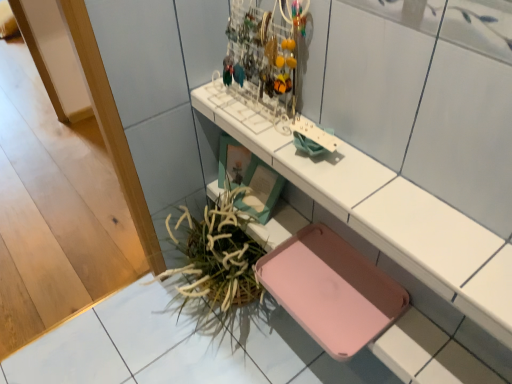
This screenshot has width=512, height=384. What do you see at coordinates (389, 216) in the screenshot?
I see `pink plastic tray at upper center` at bounding box center [389, 216].

Locate an element on the screen. Image resolution: width=512 pixels, height=384 pixels. pink plastic tray at upper center is located at coordinates (389, 216).

The width and height of the screenshot is (512, 384). What do you see at coordinates (217, 255) in the screenshot?
I see `green leafy plant at lower left` at bounding box center [217, 255].

Locate an element on the screen. green leafy plant at lower left is located at coordinates (217, 255).

Locate an element on the screen. The height and width of the screenshot is (384, 512). pink plastic tray at upper center is located at coordinates (389, 216).

From the picture: Which object is positioned more to the right, pink plastic tray at upper center or green leafy plant at lower left?

Positioned to the right is pink plastic tray at upper center.

Which object is further away from the camera taking this photo, pink plastic tray at upper center or green leafy plant at lower left?

Positioned behind is green leafy plant at lower left.

Is point (388, 195) farther from camera compared to point (228, 244)?

No, (388, 195) is closer to viewer.

From the image's perspective, would you say pink plastic tray at upper center is shown under green leafy plant at lower left?

No.

From a real-world perspective, between pink plastic tray at upper center and green leafy plant at lower left, who is vertically lower?

green leafy plant at lower left, from a real-world perspective.

Which object is thinner, pink plastic tray at upper center or green leafy plant at lower left?

pink plastic tray at upper center is thinner.

Looking at this image, is pink plastic tray at upper center shorter than green leafy plant at lower left?

Indeed, pink plastic tray at upper center has a lesser height compared to green leafy plant at lower left.

Looking at this image, who is smaller, pink plastic tray at upper center or green leafy plant at lower left?

With smaller size is pink plastic tray at upper center.

Is green leafy plant at lower left surrounded by pink plastic tray at upper center?

Actually, green leafy plant at lower left is outside pink plastic tray at upper center.

Is pink plastic tray at upper center with green leafy plant at lower left?

They are not placed beside each other.

Consider the image. Is pink plastic tray at upper center positioned with its back to green leafy plant at lower left?

No, green leafy plant at lower left is not at the back of pink plastic tray at upper center.

Can you tell me how much pink plastic tray at upper center and green leafy plant at lower left differ in facing direction?

The angle between the facing direction of pink plastic tray at upper center and the facing direction of green leafy plant at lower left is 0.756 degrees.

Locate an element on the screen. The height and width of the screenshot is (384, 512). shelf located on the right of green leafy plant at lower left is located at coordinates click(x=389, y=216).

Consider the image. Which is more to the right, green leafy plant at lower left or pink plastic tray at upper center?

pink plastic tray at upper center.

Considering the positions of objects green leafy plant at lower left and pink plastic tray at upper center in the image provided, who is in front, green leafy plant at lower left or pink plastic tray at upper center?

Positioned in front is pink plastic tray at upper center.

Does point (237, 197) come farther from viewer compared to point (371, 197)?

That is True.

From the image's perspective, is green leafy plant at lower left located above or below pink plastic tray at upper center?

Clearly, from the image's perspective, green leafy plant at lower left is below pink plastic tray at upper center.

From a real-world perspective, between green leafy plant at lower left and pink plastic tray at upper center, who is vertically higher?

pink plastic tray at upper center is physically above.

Between green leafy plant at lower left and pink plastic tray at upper center, which one has larger width?

With larger width is green leafy plant at lower left.

Considering the relative sizes of green leafy plant at lower left and pink plastic tray at upper center in the image provided, is green leafy plant at lower left taller than pink plastic tray at upper center?

Yes.

Which of these two, green leafy plant at lower left or pink plastic tray at upper center, is bigger?

green leafy plant at lower left is bigger.

From the picture: Can pink plastic tray at upper center be found inside green leafy plant at lower left?

No, pink plastic tray at upper center is not surrounded by green leafy plant at lower left.

Is green leafy plant at lower left in contact with pink plastic tray at upper center?

green leafy plant at lower left and pink plastic tray at upper center are clearly separated.

Could you tell me if green leafy plant at lower left is facing pink plastic tray at upper center?

No, green leafy plant at lower left does not turn towards pink plastic tray at upper center.

How many degrees apart are the facing directions of green leafy plant at lower left and pink plastic tray at upper center?

The facing directions of green leafy plant at lower left and pink plastic tray at upper center are 0.756 degrees apart.

How far apart are green leafy plant at lower left and pink plastic tray at upper center?

green leafy plant at lower left and pink plastic tray at upper center are 18.35 inches apart.

Identify the location of plant below the pink plastic tray at upper center (from a real-world perspective). (217, 255).

This screenshot has width=512, height=384. Identify the location of plant directly beneath the pink plastic tray at upper center (from a real-world perspective). (217, 255).

The height and width of the screenshot is (384, 512). Find the location of `shelf on the right of green leafy plant at lower left`. shelf on the right of green leafy plant at lower left is located at coordinates (389, 216).